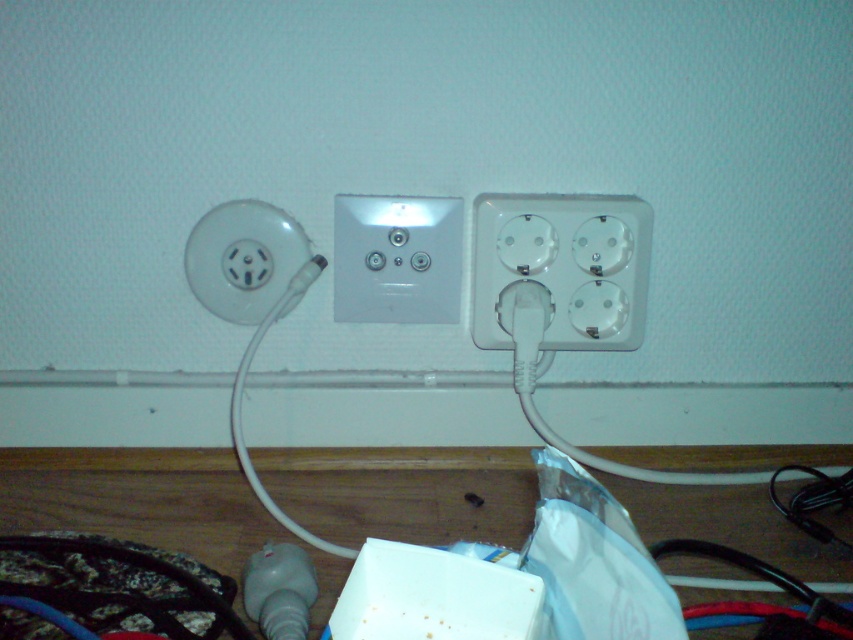
You are holding a 60 cm long tool and want to reach the white plastic socket at center right from your current position. Can you reach it?

The white plastic socket at center right is 70.47 centimeters from the camera, so a 60 cm tool would not be long enough to reach it.

You are setting up a new lamp and need to plug it into one of the sockets. The lamp has a long cord that needs to be kept away from the wall to avoid tripping hazards. Which socket, the white plastic socket at center or the white plastic socket at left, should you plug the lamp into to ensure the cord stays away from the wall?

The white plastic socket at center is to the right of the white plastic socket at left. Since the lamp has a long cord that needs to be kept away from the wall, plugging it into the white plastic socket at center would position the cord further away from the wall compared to the left socket.